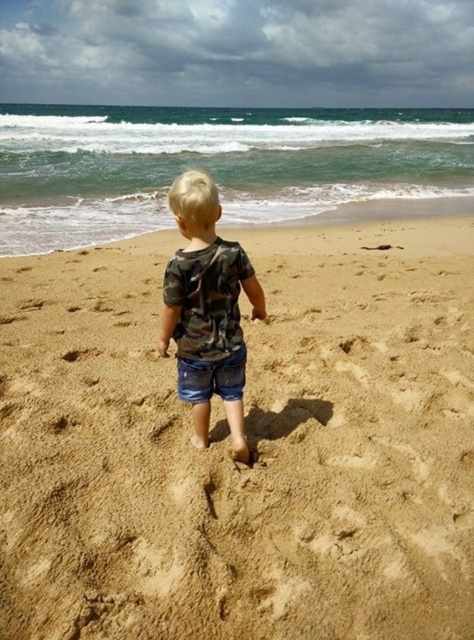
Does brown sandy beach at center appear over camo fabric shirt at center?

Incorrect, brown sandy beach at center is not positioned above camo fabric shirt at center.

Image resolution: width=474 pixels, height=640 pixels. I want to click on brown sandy beach at center, so click(249, 444).